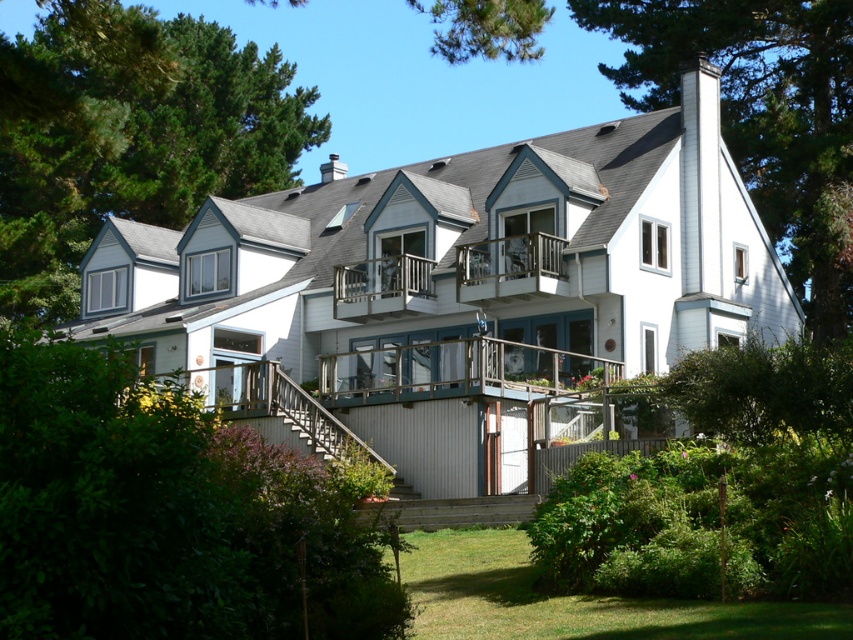
Does green leafy tree at upper right have a lesser width compared to wooden at center?

In fact, green leafy tree at upper right might be wider than wooden at center.

Locate an element on the screen. The image size is (853, 640). green leafy tree at upper right is located at coordinates (762, 116).

Locate an element on the screen. The image size is (853, 640). green leafy tree at upper right is located at coordinates (762, 116).

Does green leafy tree at upper left have a greater height compared to metallic gray staircase at center?

Yes, green leafy tree at upper left is taller than metallic gray staircase at center.

Is point (254, 112) positioned after point (281, 403)?

That is True.

Which is behind, point (173, 19) or point (386, 464)?

Positioned behind is point (173, 19).

Find the location of a particular element. green leafy tree at upper left is located at coordinates (129, 134).

Between clear glass balcony at center and metallic gray staircase at center, which one has more height?

clear glass balcony at center is taller.

Find the location of `clear glass balcony at center`. clear glass balcony at center is located at coordinates (457, 371).

Image resolution: width=853 pixels, height=640 pixels. In order to click on clear glass balcony at center in this screenshot , I will do `click(457, 371)`.